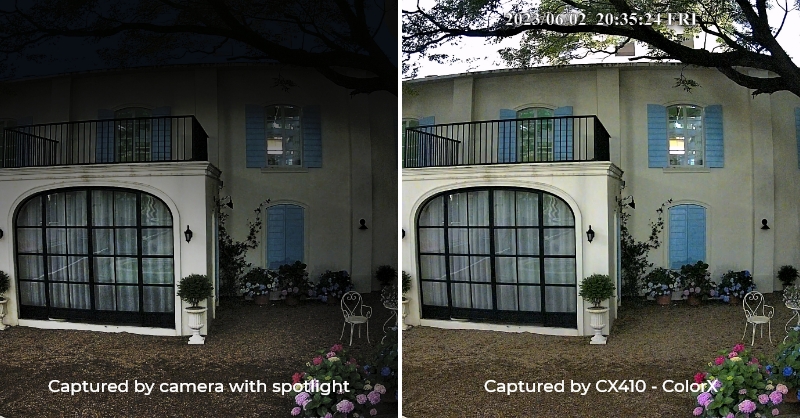
This screenshot has height=418, width=800. I want to click on white planter pot, so click(x=597, y=318), click(x=196, y=317), click(x=406, y=310), click(x=2, y=308).